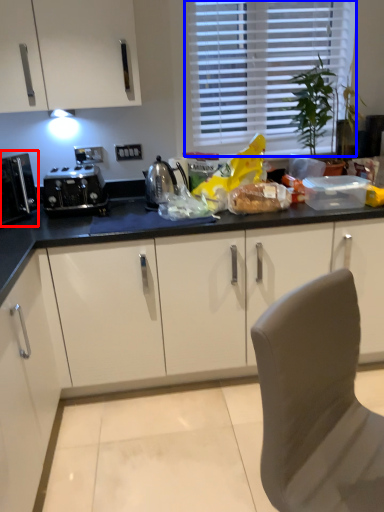
Question: Which object appears closest to the camera in this image, kitchen appliance (highlighted by a red box) or window (highlighted by a blue box)?

Choices:
 (A) kitchen appliance
 (B) window

Answer: (A)